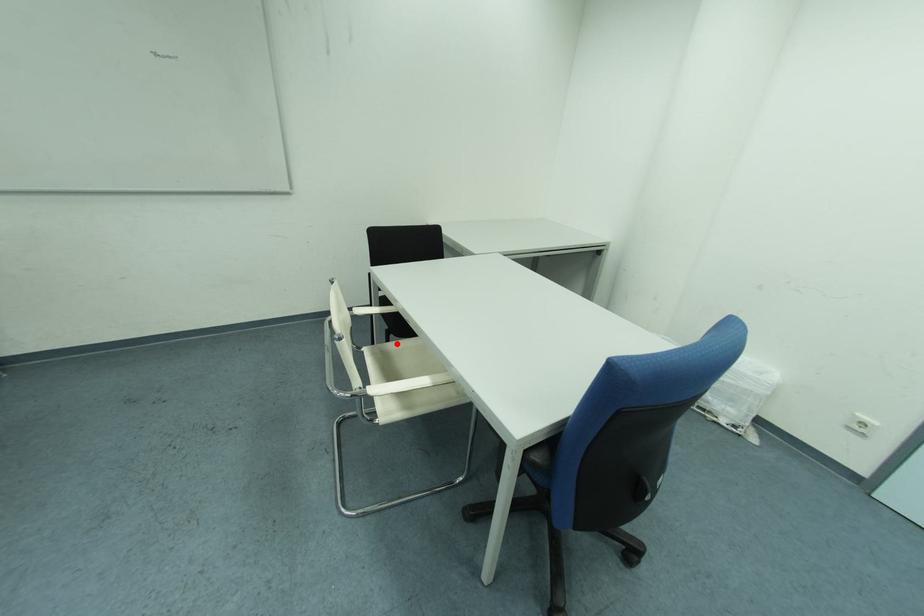
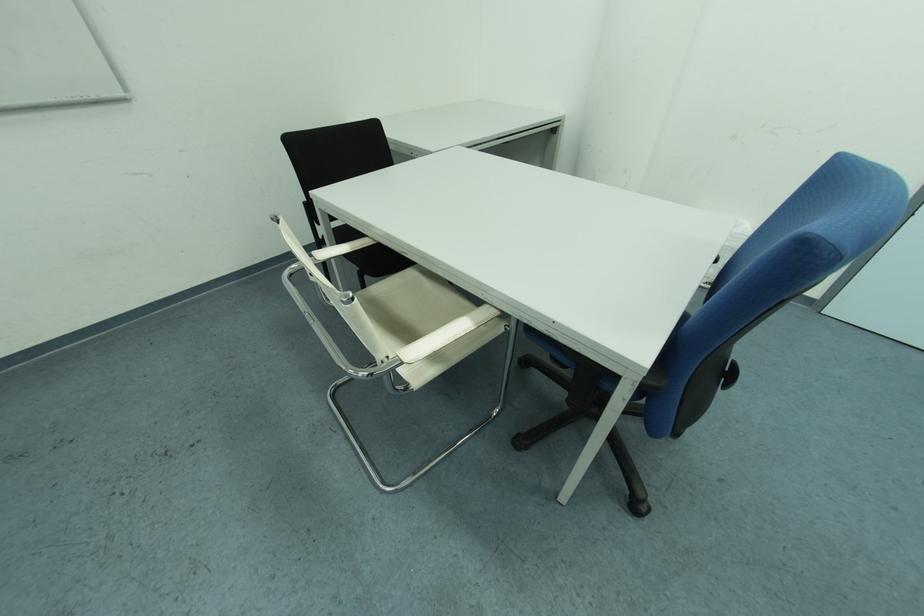
Where in the second image is the point corresponding to the highlighted location from the first image?

(372, 286)